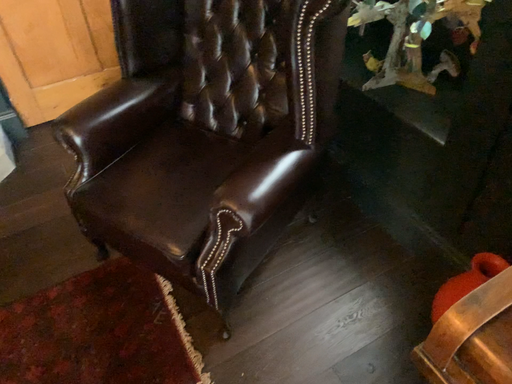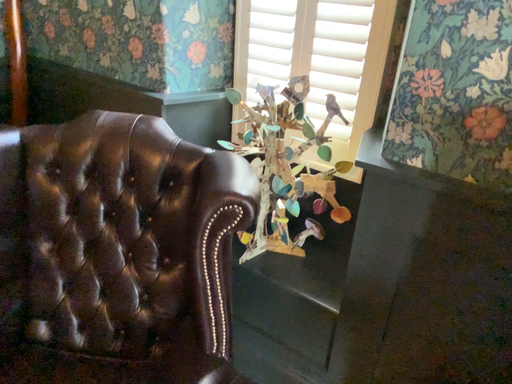
Question: Which way did the camera rotate in the video?

Choices:
 (A) rotated left
 (B) rotated right

Answer: (B)